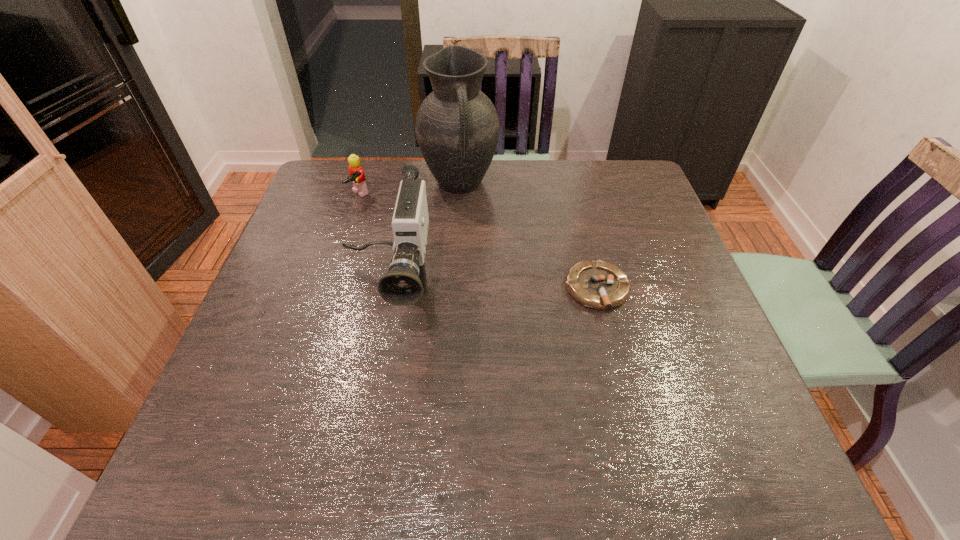
Find the location of a particular element. The image size is (960, 540). free space between the Lego and the rightmost object is located at coordinates (478, 242).

The image size is (960, 540). Identify the location of free space between the shortest object and the second tallest object. (492, 289).

Where is `the closest object to the pitcher`? The width and height of the screenshot is (960, 540). the closest object to the pitcher is located at coordinates (357, 177).

This screenshot has height=540, width=960. What are the coordinates of `object that is the third nearest to the tallest object` in the screenshot? It's located at (599, 285).

Where is `blank space that satisfies the following two spatial constraints: 1. on the front side of the shortest object; 2. on the left side of the tallest object`? The height and width of the screenshot is (540, 960). blank space that satisfies the following two spatial constraints: 1. on the front side of the shortest object; 2. on the left side of the tallest object is located at coordinates (454, 289).

Where is `vacant area that satisfies the following two spatial constraints: 1. on the recording direction of the rightmost object; 2. on the left side of the camcorder`? vacant area that satisfies the following two spatial constraints: 1. on the recording direction of the rightmost object; 2. on the left side of the camcorder is located at coordinates (388, 289).

Image resolution: width=960 pixels, height=540 pixels. Find the location of `free spot that satisfies the following two spatial constraints: 1. on the recording direction of the shortest object; 2. on the left side of the camcorder`. free spot that satisfies the following two spatial constraints: 1. on the recording direction of the shortest object; 2. on the left side of the camcorder is located at coordinates (388, 289).